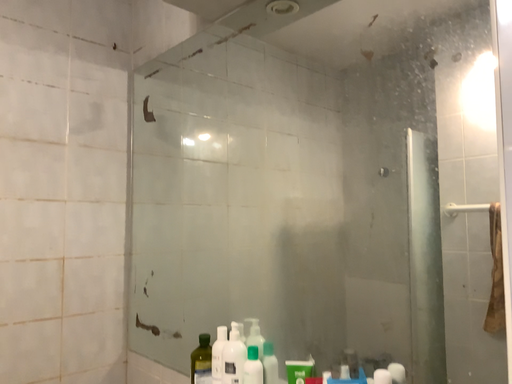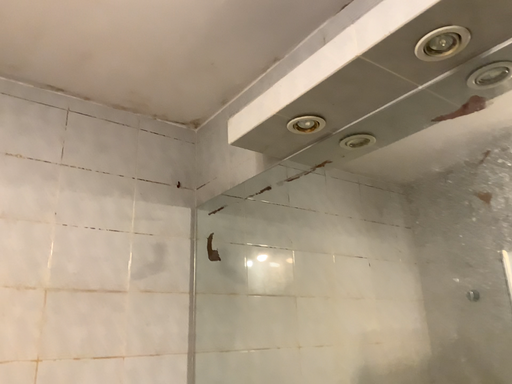
Question: How did the camera likely rotate when shooting the video?

Choices:
 (A) rotated left
 (B) rotated right

Answer: (A)